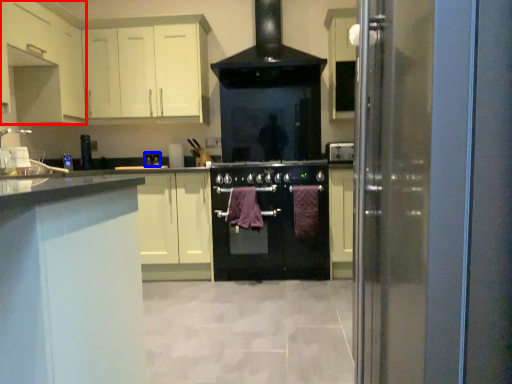
Question: Which of the following is the farthest to the observer, cabinetry (highlighted by a red box) or appliance (highlighted by a blue box)?

Choices:
 (A) cabinetry
 (B) appliance

Answer: (B)